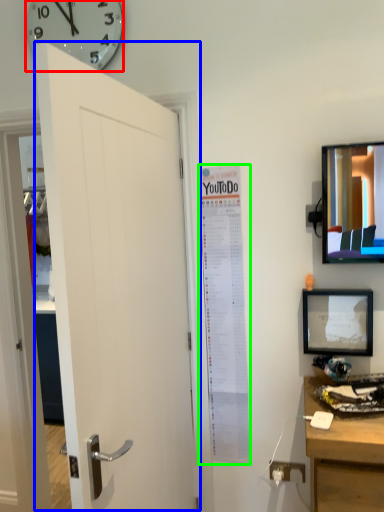
Question: Which is nearer to the wall clock (highlighted by a red box)? door (highlighted by a blue box) or poster page (highlighted by a green box).

Choices:
 (A) door
 (B) poster page

Answer: (A)